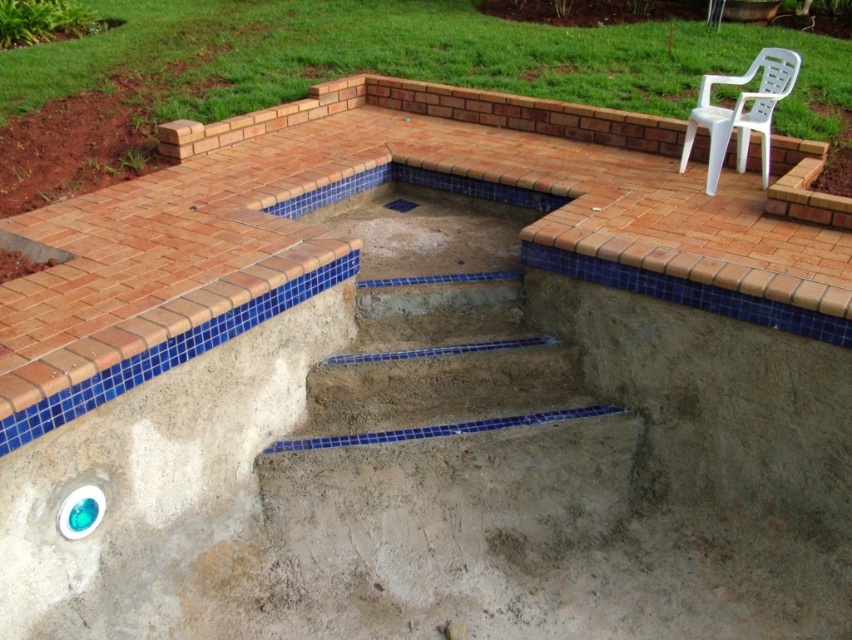
Question: Which object is the farthest from the concrete steps at center?

Choices:
 (A) blue mosaic tiles at center
 (B) white plastic chair at upper right

Answer: (B)

Question: Which object appears closest to the camera in this image?

Choices:
 (A) blue mosaic tiles at center
 (B) concrete steps at center
 (C) white plastic chair at upper right

Answer: (A)

Question: Can you confirm if blue mosaic tiles at center is thinner than white plastic chair at upper right?

Choices:
 (A) no
 (B) yes

Answer: (A)

Question: Does concrete steps at center have a greater width compared to white plastic chair at upper right?

Choices:
 (A) yes
 (B) no

Answer: (A)

Question: Which object appears farthest from the camera in this image?

Choices:
 (A) white plastic chair at upper right
 (B) blue mosaic tiles at center
 (C) concrete steps at center

Answer: (C)

Question: Is blue mosaic tiles at center thinner than white plastic chair at upper right?

Choices:
 (A) no
 (B) yes

Answer: (A)